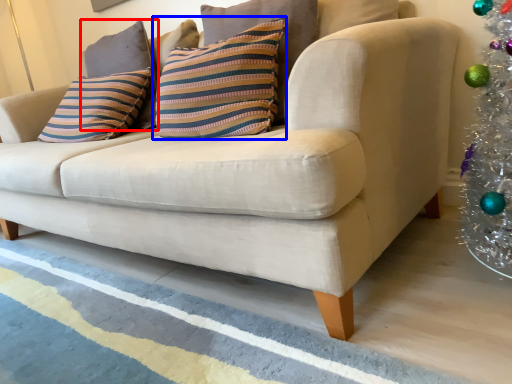
Question: Which of the following is the farthest to the observer, pillow (highlighted by a red box) or pillow (highlighted by a blue box)?

Choices:
 (A) pillow
 (B) pillow

Answer: (A)